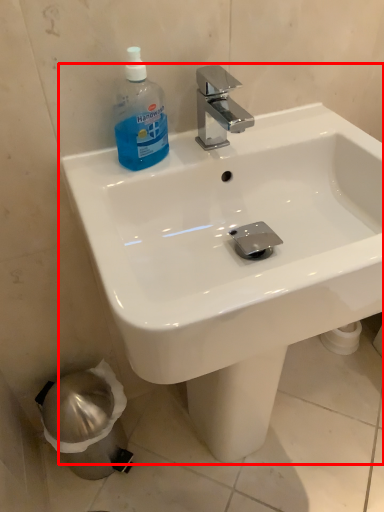
Question: From the image, what is the correct spatial relationship of sink (annotated by the red box) in relation to cleaning product?

Choices:
 (A) right
 (B) left

Answer: (A)